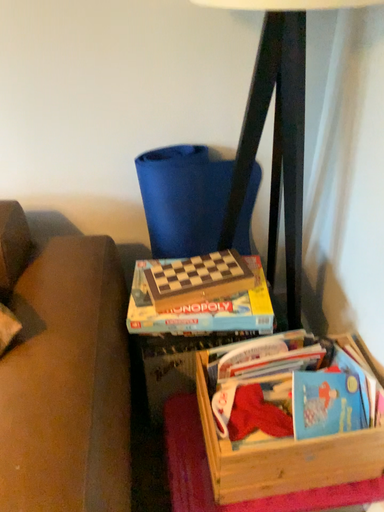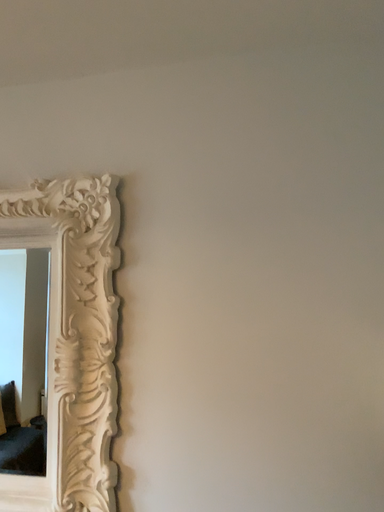
Question: Which way did the camera rotate in the video?

Choices:
 (A) rotated right
 (B) rotated left

Answer: (B)